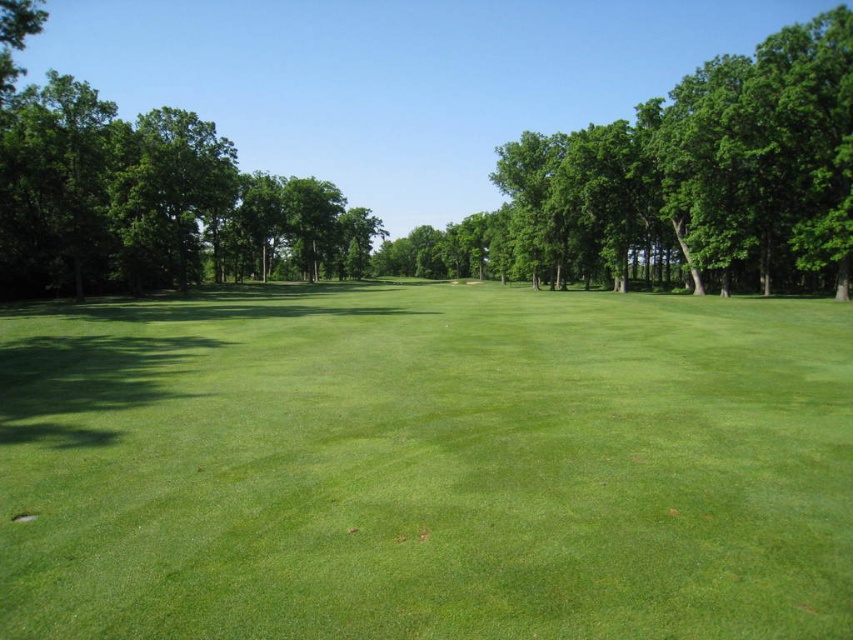
You are a golfer standing at the edge of the green grassy field at center. You want to hit a golf ball to the other side of the field. The ball travels at 20 feet per second. How many seconds will it take for the ball to reach the other side?

The green grassy field at center and camera are 14.92 feet apart from each other. Assuming the distance to the other side is similar, the ball traveling at 20 feet per second would take approximately 0.746 seconds to reach the other side.

You are a golfer standing at the tee, and you see the green leafy tree at center in the distance. Your golf ball is currently 30 meters away from the tree. Can you estimate whether your ball is closer to the tree than you are?

The green leafy tree at center is 28.57 meters away from you. Since your ball is 30 meters away from the tree, the ball is farther from the tree than you are. Therefore, you are closer to the tree than your ball is.